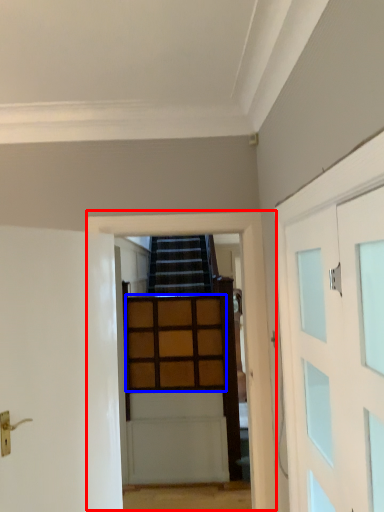
Question: Which object is further to the camera taking this photo, garage door (highlighted by a red box) or cabinetry (highlighted by a blue box)?

Choices:
 (A) garage door
 (B) cabinetry

Answer: (B)